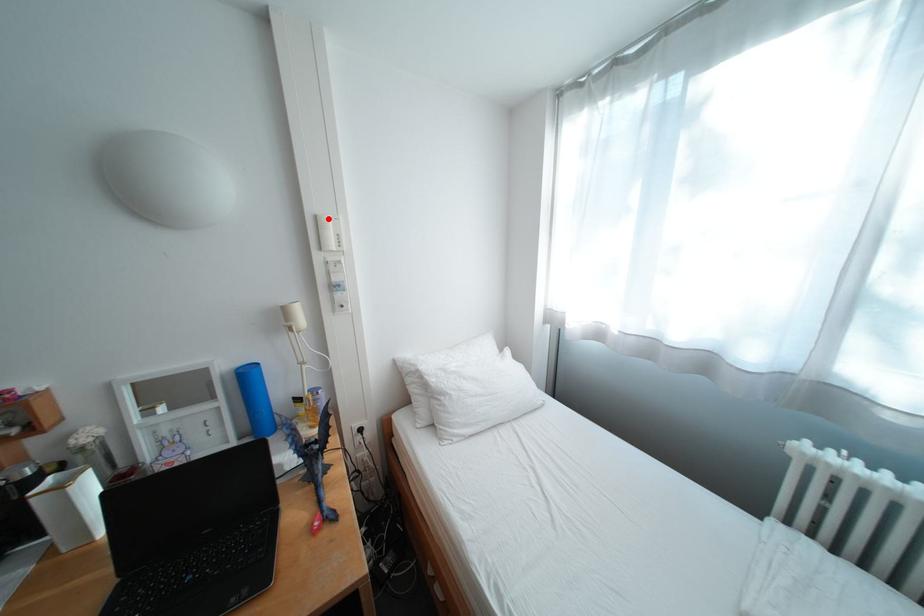
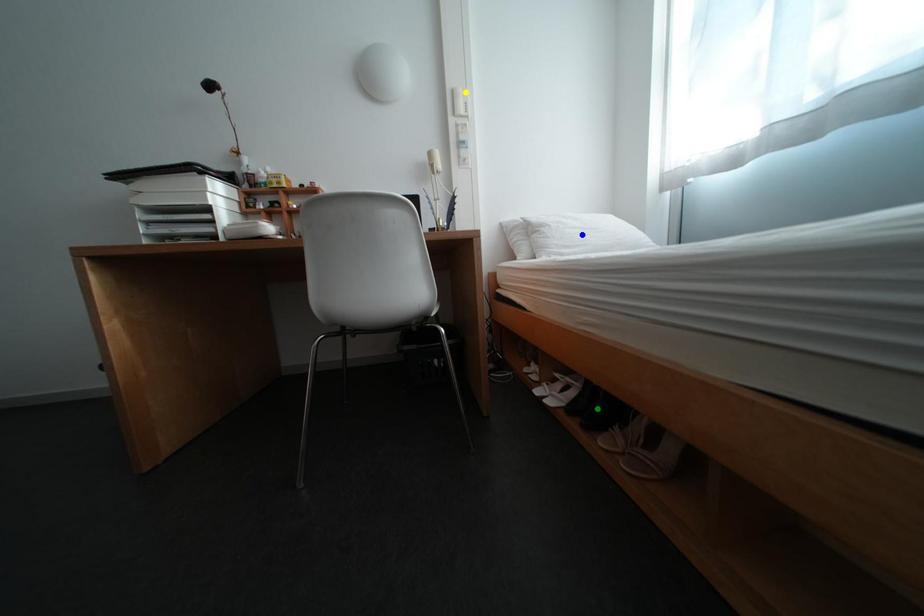
Question: I am providing you with two images of the same scene from different viewpoints. A red point is marked on the first image. You are given multiple points on the second image. In image 2, which mark is for the same physical point as the one in image 1?

Choices:
 (A) green point
 (B) blue point
 (C) yellow point

Answer: (C)